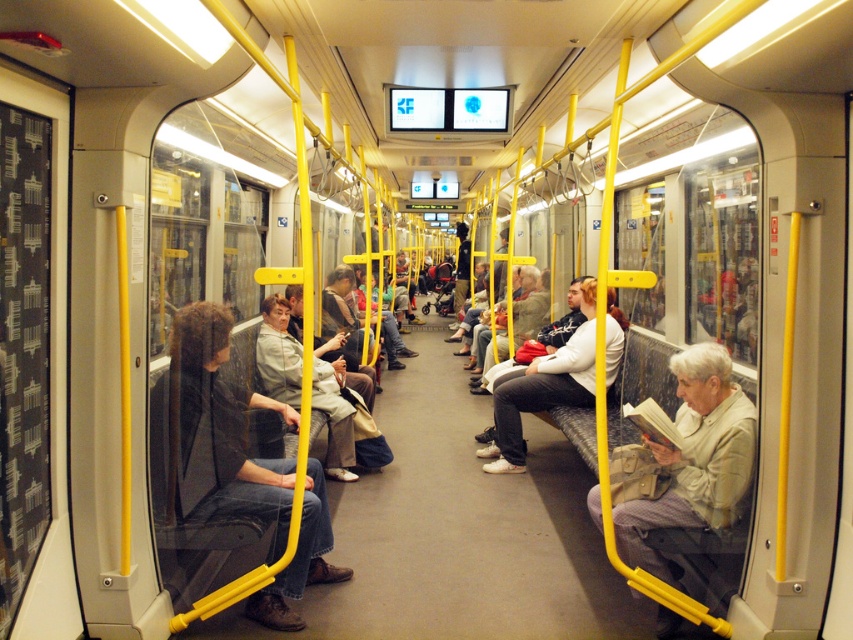
You are a passenger on the train and need to store your bag. You see a light beige jacket at center and a white matte jacket at center. Which jacket is taking up less space and would allow you to place your bag in the remaining area?

The light beige jacket at center occupies less space than the white matte jacket at center, so placing your bag next to the light beige jacket at center would leave more room.

You are a passenger on this train and you want to reach the window to enjoy the view. You are currently sitting in a seat facing the light beige jacket at center and the white matte jacket at center. Which jacket should you pass by first when moving towards the window?

The light beige jacket at center is shorter than the white matte jacket at center, so you should pass by the light beige jacket at center first because it is closer to you.

You are a passenger in the train carriage and want to sit down. There is a spot available at point (213, 433). However, you notice something there. What object is located at that point?

The dark gray jeans at center are located at point (213, 433).